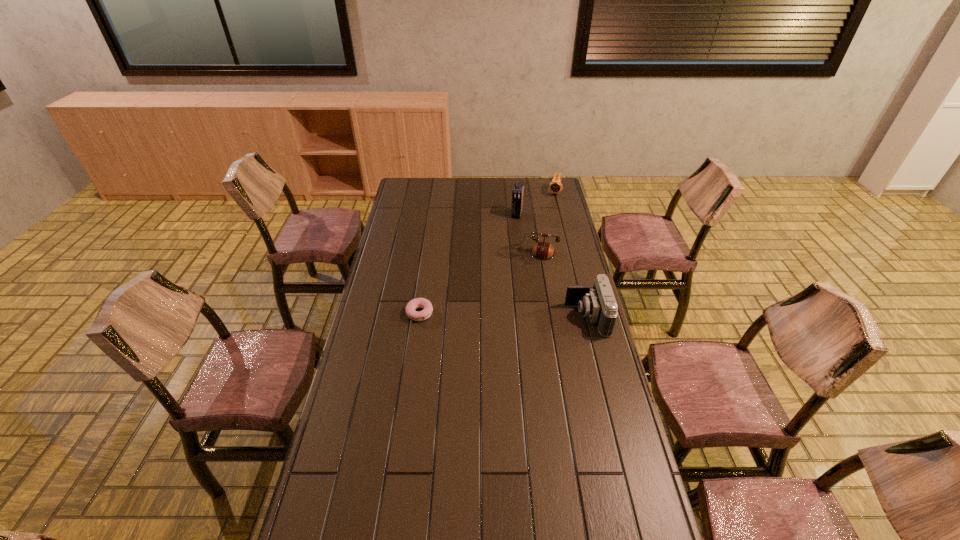
The width and height of the screenshot is (960, 540). What are the coordinates of `unoccupied area between the tallest object and the leftmost object` in the screenshot? It's located at (468, 264).

Where is `the fourth closest object to the watch`? The image size is (960, 540). the fourth closest object to the watch is located at coordinates (412, 305).

Identify the location of object that stands as the fourth closest to the shortest object. (555, 186).

Identify the location of vacant space that satisfies the following two spatial constraints: 1. on the front side of the camera; 2. at the front of the telephone with an open lens cover. (537, 317).

The width and height of the screenshot is (960, 540). I want to click on free point that satisfies the following two spatial constraints: 1. on the back side of the telephone; 2. on the left side of the doughnut, so tap(428, 254).

Identify the location of blank space that satisfies the following two spatial constraints: 1. on the back side of the tallest object; 2. on the left side of the watch. (514, 192).

Locate an element on the screen. The width and height of the screenshot is (960, 540). vacant space that satisfies the following two spatial constraints: 1. on the back side of the doughnut; 2. on the right side of the farthest object is located at coordinates (437, 192).

The width and height of the screenshot is (960, 540). In order to click on vacant space that satisfies the following two spatial constraints: 1. on the back side of the shortest object; 2. on the left side of the telephone in this screenshot , I will do `click(428, 254)`.